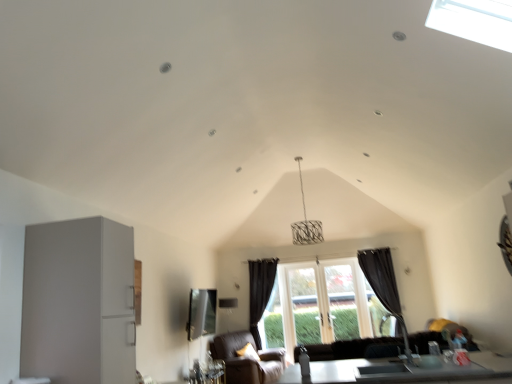
Question: Can you confirm if transparent glass window at center is thinner than matte glass window screen at center?

Choices:
 (A) yes
 (B) no

Answer: (A)

Question: Does transparent glass window at center come behind matte glass window screen at center?

Choices:
 (A) yes
 (B) no

Answer: (A)

Question: Considering the relative sizes of transparent glass window at center and matte glass window screen at center in the image provided, is transparent glass window at center wider than matte glass window screen at center?

Choices:
 (A) yes
 (B) no

Answer: (B)

Question: Does transparent glass window at center touch matte glass window screen at center?

Choices:
 (A) no
 (B) yes

Answer: (A)

Question: Could you tell me if transparent glass window at center is turned towards matte glass window screen at center?

Choices:
 (A) yes
 (B) no

Answer: (A)

Question: Does transparent glass window at center appear on the left side of matte glass window screen at center?

Choices:
 (A) yes
 (B) no

Answer: (B)

Question: From a real-world perspective, is matte glass window screen at center beneath black fabric curtain at center, which ranks as the second curtain in right-to-left order?

Choices:
 (A) no
 (B) yes

Answer: (A)

Question: Is matte glass window screen at center facing away from black fabric curtain at center, which is counted as the first curtain, starting from the left?

Choices:
 (A) yes
 (B) no

Answer: (B)

Question: From the image's perspective, does matte glass window screen at center appear higher than black fabric curtain at center, which ranks as the second curtain in right-to-left order?

Choices:
 (A) yes
 (B) no

Answer: (A)

Question: Is matte glass window screen at center with black fabric curtain at center, which is counted as the first curtain, starting from the left?

Choices:
 (A) yes
 (B) no

Answer: (B)

Question: Considering the relative sizes of matte glass window screen at center and black fabric curtain at center, which is counted as the first curtain, starting from the left, in the image provided, is matte glass window screen at center bigger than black fabric curtain at center, which is counted as the first curtain, starting from the left,?

Choices:
 (A) no
 (B) yes

Answer: (A)

Question: Can you confirm if matte glass window screen at center is thinner than black fabric curtain at center, which is counted as the first curtain, starting from the left?

Choices:
 (A) yes
 (B) no

Answer: (B)

Question: Is transparent glass window at center not near brown leather armchair at lower center?

Choices:
 (A) no
 (B) yes

Answer: (B)